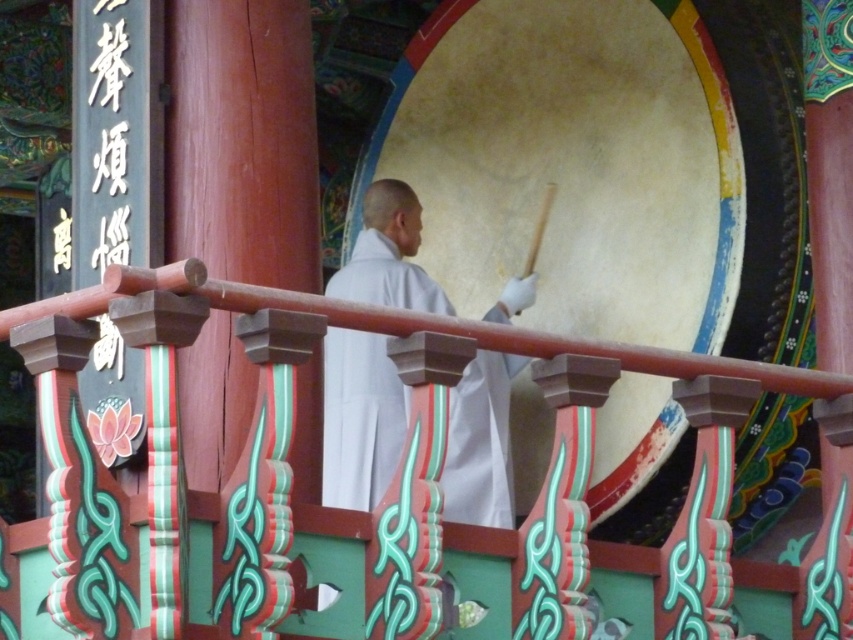
Question: Is smooth beige drum at center thinner than white cloth monk at center?

Choices:
 (A) no
 (B) yes

Answer: (A)

Question: Can you confirm if smooth beige drum at center is thinner than white cloth monk at center?

Choices:
 (A) yes
 (B) no

Answer: (B)

Question: Where is smooth beige drum at center located in relation to white cloth monk at center in the image?

Choices:
 (A) below
 (B) above

Answer: (B)

Question: Among these points, which one is farthest from the camera?

Choices:
 (A) (329, 349)
 (B) (712, 125)

Answer: (A)

Question: Which object is farther from the camera taking this photo?

Choices:
 (A) smooth beige drum at center
 (B) white cloth monk at center

Answer: (A)